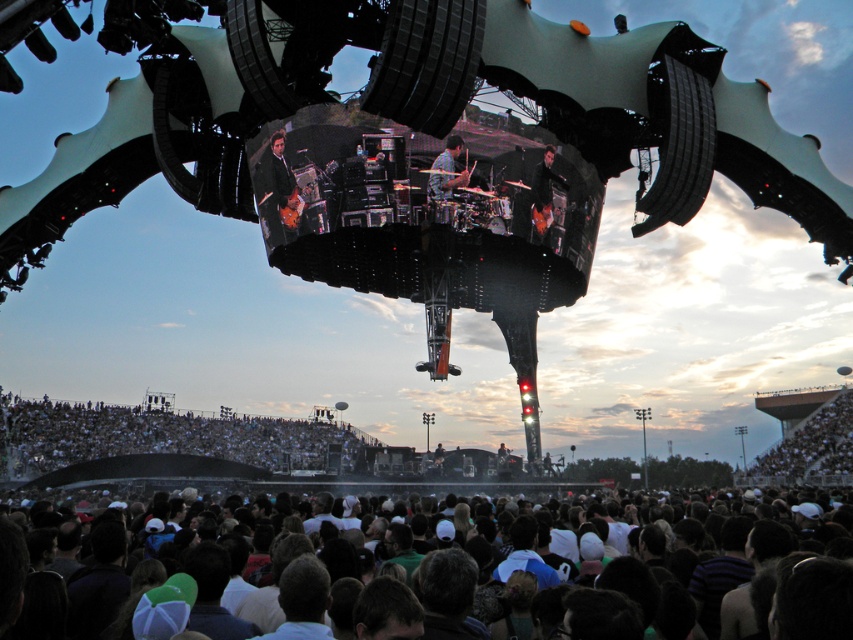
Is shiny black guitar at center wider than smooth skin drumsticks at center?

Indeed, shiny black guitar at center has a greater width compared to smooth skin drumsticks at center.

Is point (289, 172) positioned before point (438, 189)?

No, (289, 172) is further to viewer.

Locate an element on the screen. The height and width of the screenshot is (640, 853). shiny black guitar at center is located at coordinates (277, 193).

From the picture: Between white fabric crowd at lower center and shiny black guitar at center, which one appears on the left side from the viewer's perspective?

white fabric crowd at lower center is more to the left.

What are the coordinates of `white fabric crowd at lower center` in the screenshot? It's located at (169, 436).

Is white fabric crowd at lower center below smooth skin drumsticks at center?

Yes.

Is point (61, 445) positioned before point (439, 157)?

No, it is not.

Is point (158, 440) farther from viewer compared to point (430, 170)?

Yes, point (158, 440) is behind point (430, 170).

Locate an element on the screen. white fabric crowd at lower center is located at coordinates (169, 436).